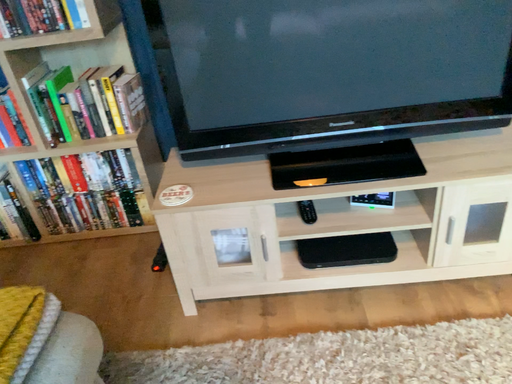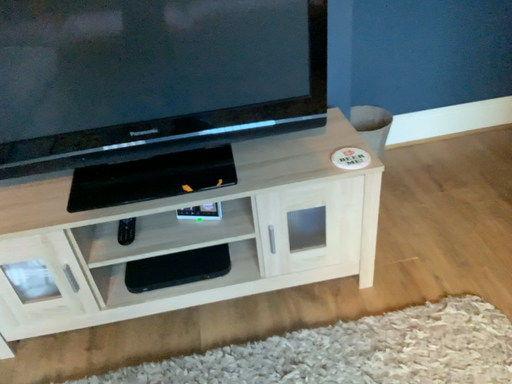
Question: Which way did the camera rotate in the video?

Choices:
 (A) rotated right
 (B) rotated left

Answer: (A)